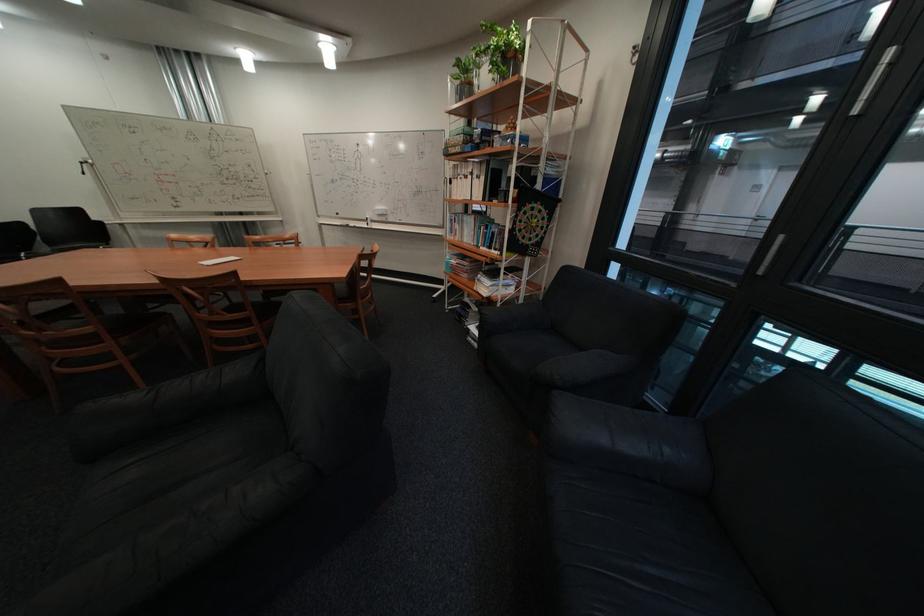
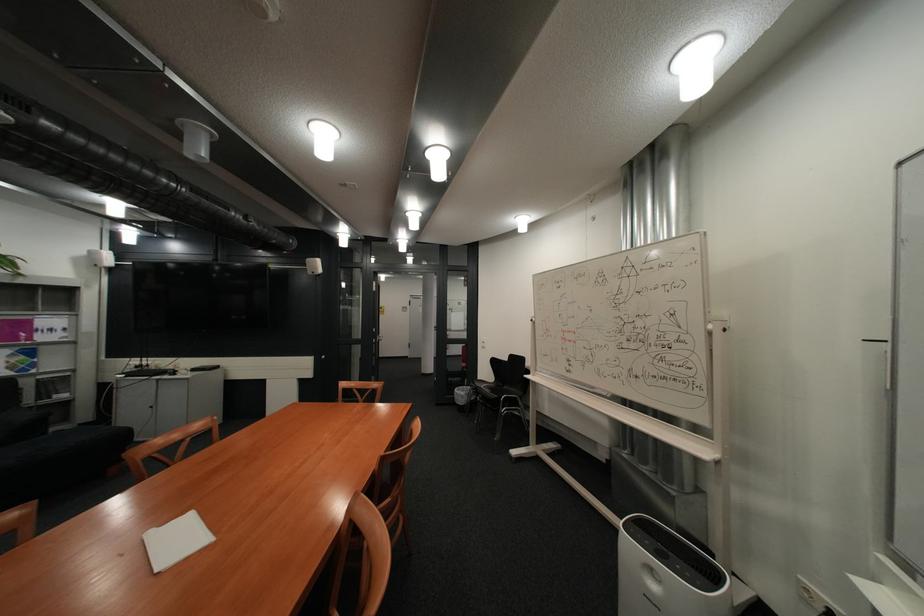
Locate, in the second image, the point that corresponds to point (314, 243) in the first image.

(728, 576)